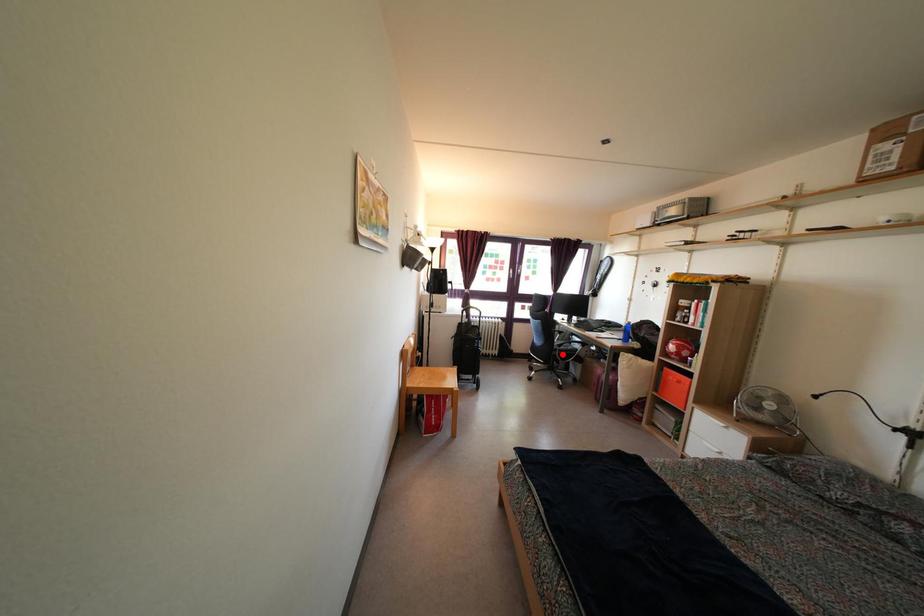
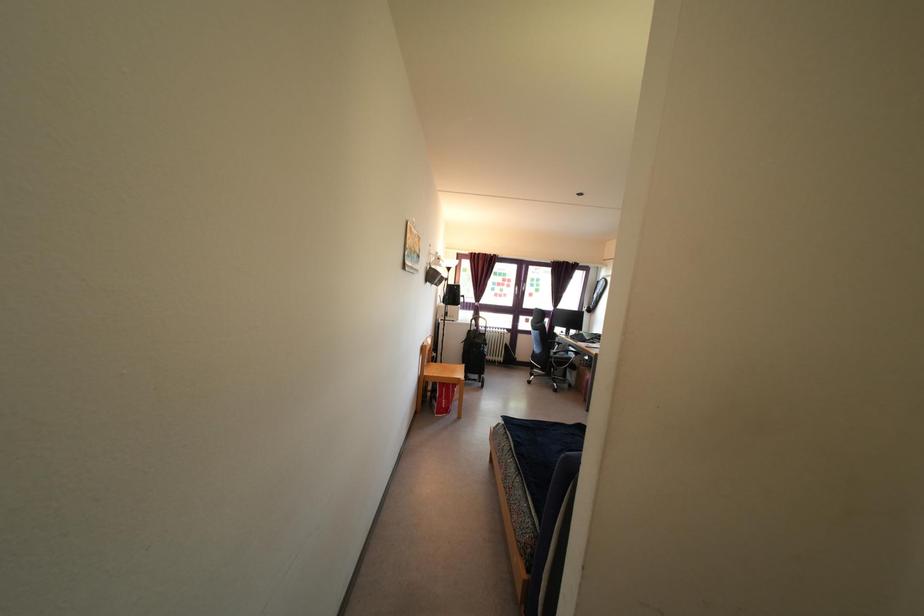
Locate, in the second image, the point that corresponds to the highlighted location in the first image.

(557, 362)